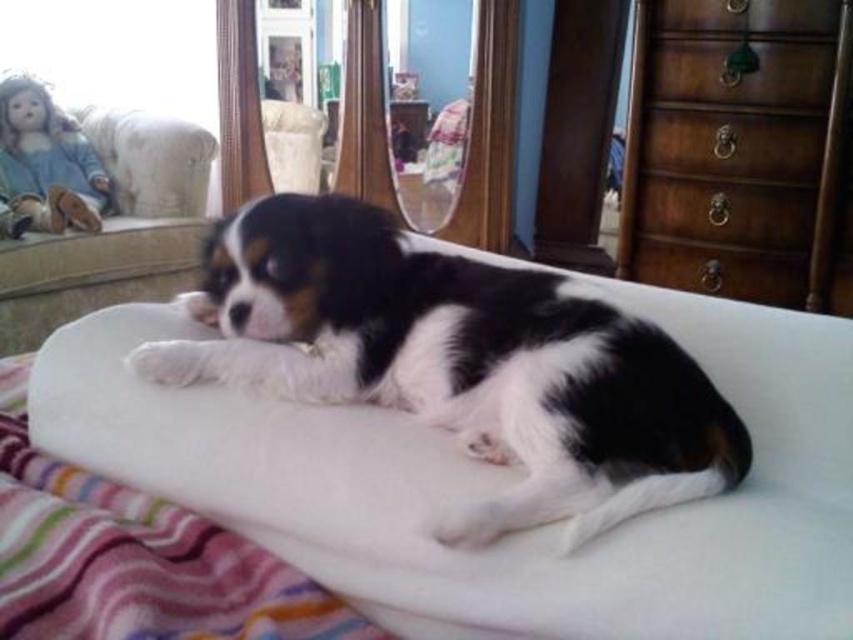
You are a photographer trying to capture the puppy in the scene. You notice the black and white fur at center and the white fluffy blanket at center. Which object is located to the right of the other?

The black and white fur at center is positioned on the right side of white fluffy blanket at center, so the black and white fur at center is to the right of the white fluffy blanket at center.

You are a photographer setting up a shoot in the room. You want to capture the black and white fur at center and the wooden drawer at upper right in the same frame. Based on their positions, which object is closer to the left side of the photo?

The black and white fur at center is positioned on the left side of wooden drawer at upper right, so it is closer to the left side of the photo.